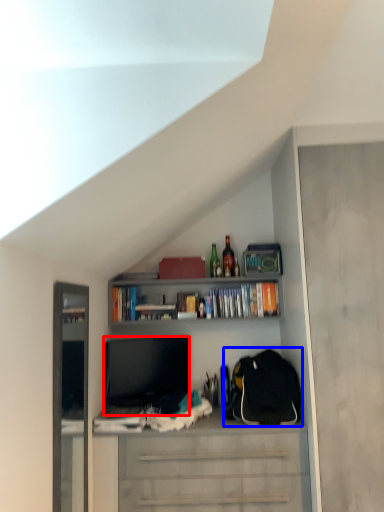
Question: Which object is closer to the camera taking this photo, television (highlighted by a red box) or backpack (highlighted by a blue box)?

Choices:
 (A) television
 (B) backpack

Answer: (B)